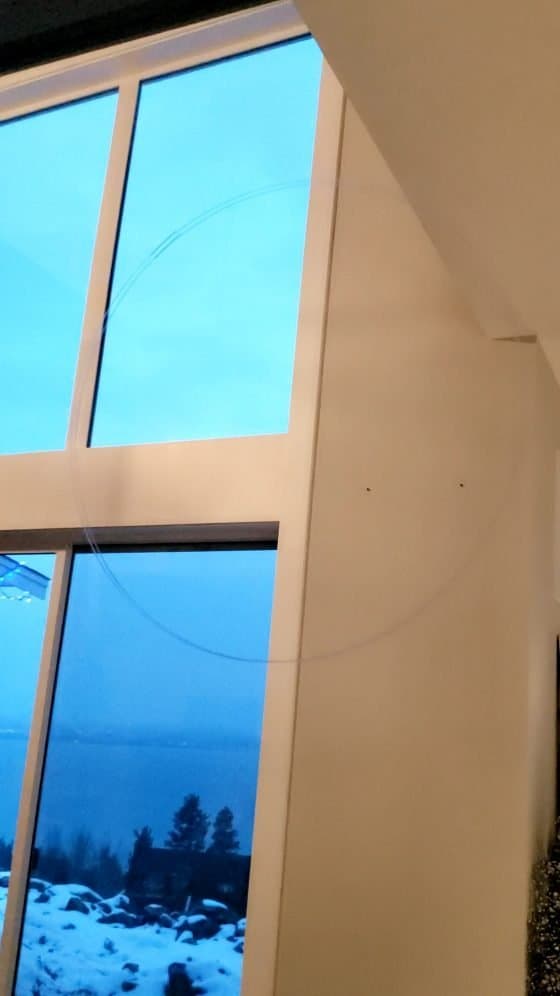
The image size is (560, 996). I want to click on string lights, so click(6, 596).